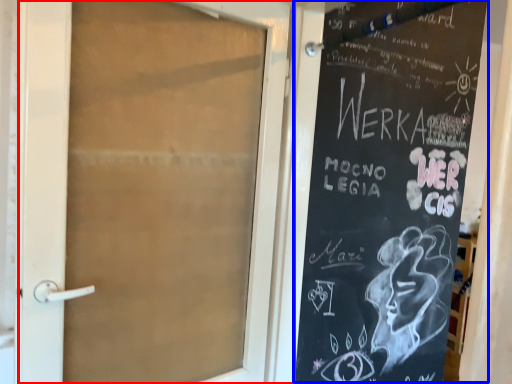
Question: Which object appears closest to the camera in this image, door (highlighted by a red box) or bulletin board (highlighted by a blue box)?

Choices:
 (A) door
 (B) bulletin board

Answer: (B)